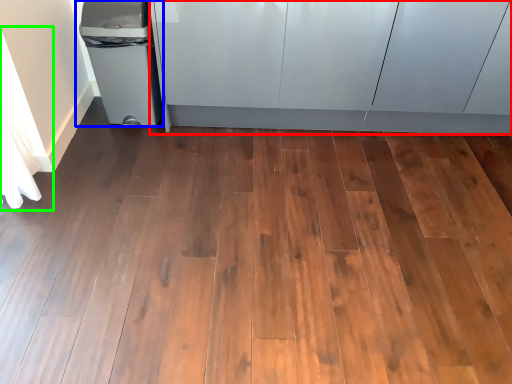
Question: Which object is positioned closest to cabinetry (highlighted by a red box)? Select from waste container (highlighted by a blue box) and curtain (highlighted by a green box).

Choices:
 (A) waste container
 (B) curtain

Answer: (A)